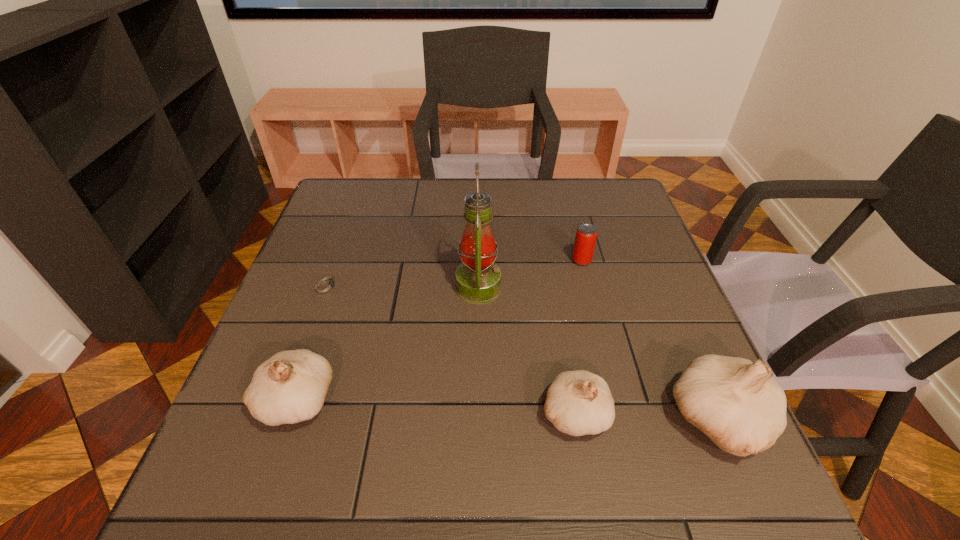
Identify the location of free location that satisfies the following two spatial constraints: 1. on the face of the shortest object; 2. on the left side of the leftmost garlic. This screenshot has height=540, width=960. (284, 400).

I want to click on vacant space that satisfies the following two spatial constraints: 1. on the face of the shortest object; 2. on the left side of the leftmost garlic, so click(x=284, y=400).

Where is `vacant space that satisfies the following two spatial constraints: 1. on the front side of the oil lamp; 2. on the right side of the shortest garlic`? The image size is (960, 540). vacant space that satisfies the following two spatial constraints: 1. on the front side of the oil lamp; 2. on the right side of the shortest garlic is located at coordinates (478, 414).

Identify the location of free region that satisfies the following two spatial constraints: 1. on the back side of the rightmost object; 2. on the face of the watch. (660, 286).

This screenshot has height=540, width=960. What are the coordinates of `vacant region that satisfies the following two spatial constraints: 1. on the back side of the leftmost garlic; 2. on the face of the shortest object` in the screenshot? It's located at (336, 286).

Identify the location of free space that satisfies the following two spatial constraints: 1. on the front side of the rightmost garlic; 2. on the left side of the shortest garlic. (576, 421).